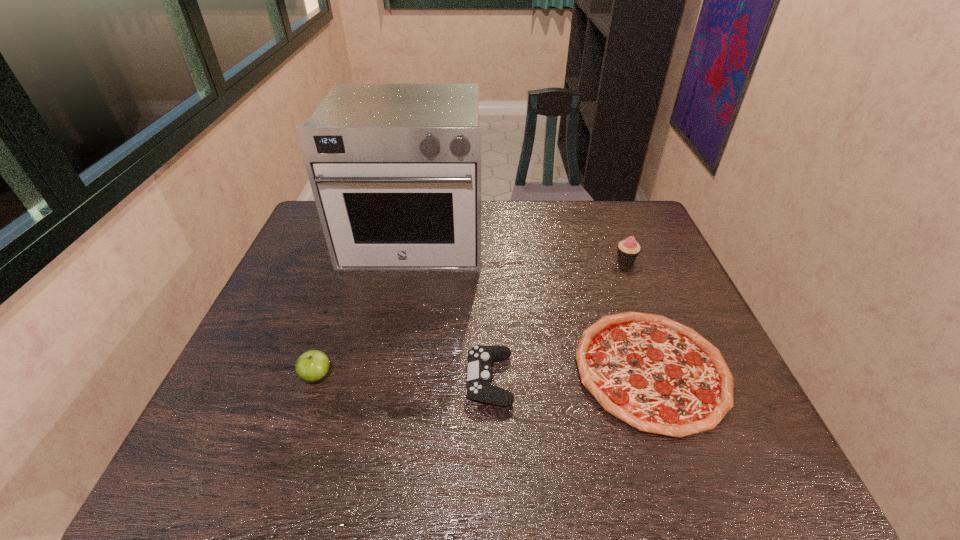
Find the location of a particular element. free area in between the control and the cupcake is located at coordinates (558, 319).

Point out which object is positioned as the third nearest to the apple. Please provide its 2D coordinates. Your answer should be formatted as a tuple, i.e. [(x, y)], where the tuple contains the x and y coordinates of a point satisfying the conditions above.

[(659, 376)]

Find the location of a particular element. object that is the second closest to the cupcake is located at coordinates (395, 169).

This screenshot has height=540, width=960. In order to click on blank area in the image that satisfies the following two spatial constraints: 1. on the back side of the apple; 2. on the right side of the cupcake in this screenshot , I will do `click(355, 260)`.

The width and height of the screenshot is (960, 540). I want to click on vacant space that satisfies the following two spatial constraints: 1. on the front panel of the cupcake; 2. on the right side of the toaster oven, so click(410, 260).